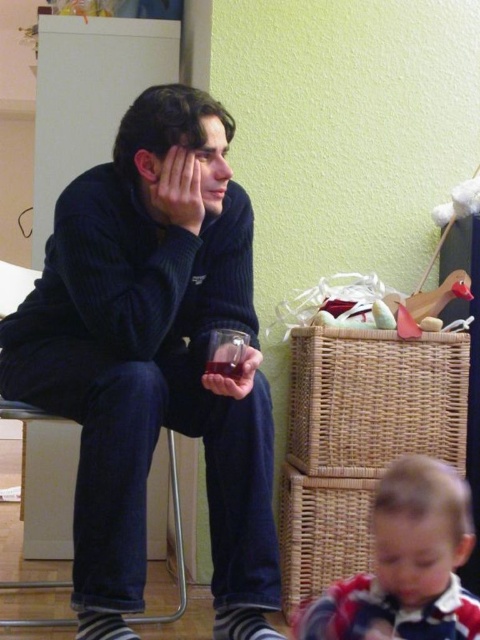
Who is higher up, red and white striped shirt at lower right or translucent plastic cup at lower center?

Positioned higher is translucent plastic cup at lower center.

How far apart are red and white striped shirt at lower right and translucent plastic cup at lower center?

red and white striped shirt at lower right is 16.97 inches from translucent plastic cup at lower center.

Image resolution: width=480 pixels, height=640 pixels. I want to click on red and white striped shirt at lower right, so click(407, 563).

Is red and white striped shirt at lower right shorter than dark blue corduroy chair at left?

Yes, red and white striped shirt at lower right is shorter than dark blue corduroy chair at left.

Is red and white striped shirt at lower right further to the viewer compared to dark blue corduroy chair at left?

No, red and white striped shirt at lower right is in front of dark blue corduroy chair at left.

Identify the location of red and white striped shirt at lower right. This screenshot has height=640, width=480. (407, 563).

Which is behind, point (27, 291) or point (215, 360)?

The point (27, 291) is more distant.

Based on the photo, between dark blue corduroy chair at left and translucent glass at lower center, which one is positioned lower?

dark blue corduroy chair at left is below.

Does point (155, 621) lie behind point (211, 362)?

Yes, point (155, 621) is farther from viewer.

Identify the location of dark blue corduroy chair at left. (175, 544).